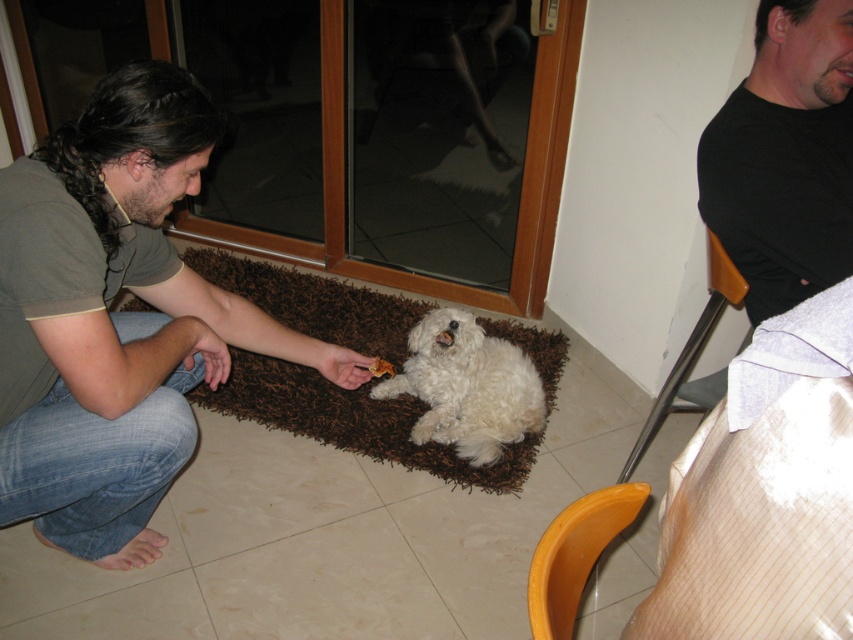
You are a visitor standing in the room. You see the matte gray shirt at center and the transparent glass door at center. Which object is closer to the floor?

The matte gray shirt at center is below the transparent glass door at center, so the matte gray shirt at center is closer to the floor.